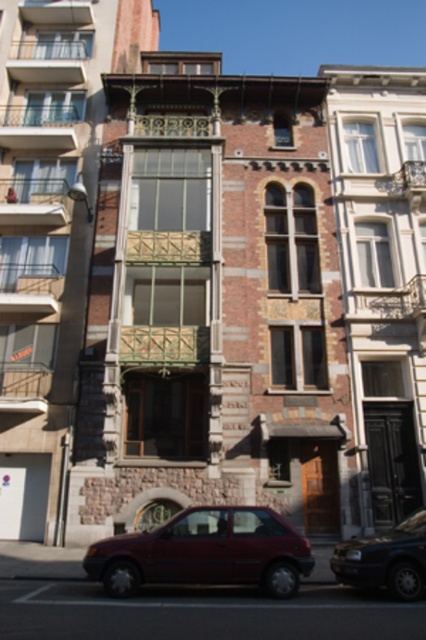
You are a delivery person trying to park a large vehicle in the driveway of this building. You see a matte red car at lower center and a dark blue metallic car at lower right. Which car is more likely to block your parking space if you need to park a large vehicle?

The matte red car at lower center is bigger than the dark blue metallic car at lower right, so it is more likely to block your parking space if you need to park a large vehicle.